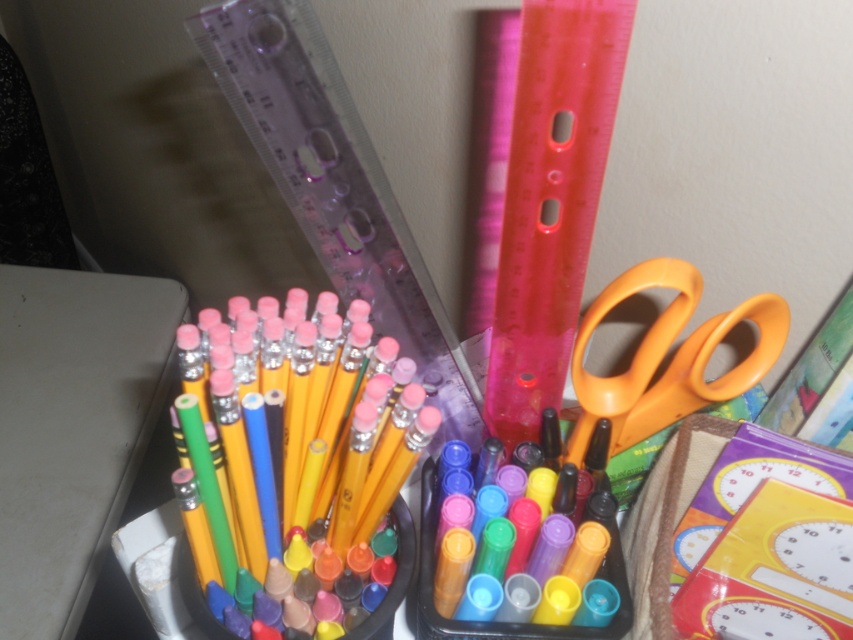
Question: Can you confirm if orange plastic scissors at right is smaller than yellow matte pencils at center?

Choices:
 (A) yes
 (B) no

Answer: (B)

Question: Considering the relative positions of orange plastic scissors at right and translucent plastic markers at center in the image provided, where is orange plastic scissors at right located with respect to translucent plastic markers at center?

Choices:
 (A) above
 (B) below

Answer: (A)

Question: Estimate the real-world distances between objects in this image. Which object is farther from the translucent plastic markers at center?

Choices:
 (A) orange plastic scissors at right
 (B) yellow matte pencils at center

Answer: (A)

Question: Considering the real-world distances, which object is farthest from the translucent plastic markers at center?

Choices:
 (A) orange plastic scissors at right
 (B) yellow matte pencils at center

Answer: (A)

Question: Does orange plastic scissors at right have a greater width compared to translucent plastic markers at center?

Choices:
 (A) yes
 (B) no

Answer: (A)

Question: Among these objects, which one is farthest from the camera?

Choices:
 (A) yellow matte pencils at center
 (B) orange plastic scissors at right
 (C) translucent plastic markers at center

Answer: (B)